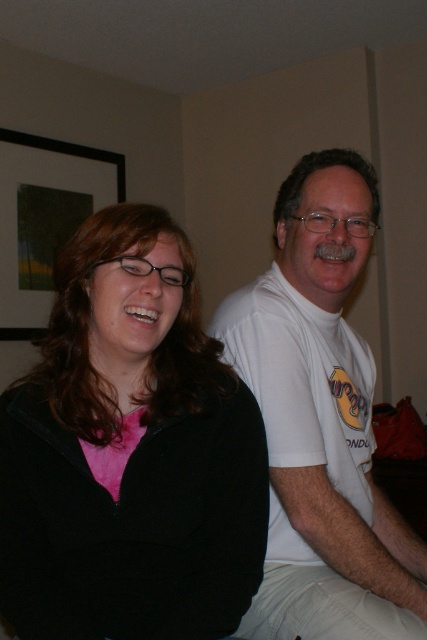
Question: Among these objects, which one is nearest to the camera?

Choices:
 (A) white cotton t-shirt at right
 (B) black matte jacket at left

Answer: (B)

Question: Among these points, which one is nearest to the camera?

Choices:
 (A) (263, 637)
 (B) (3, 509)

Answer: (B)

Question: Is black matte jacket at left bigger than white cotton t-shirt at right?

Choices:
 (A) yes
 (B) no

Answer: (B)

Question: Can you confirm if black matte jacket at left is smaller than white cotton t-shirt at right?

Choices:
 (A) no
 (B) yes

Answer: (B)

Question: Is black matte jacket at left wider than white cotton t-shirt at right?

Choices:
 (A) yes
 (B) no

Answer: (B)